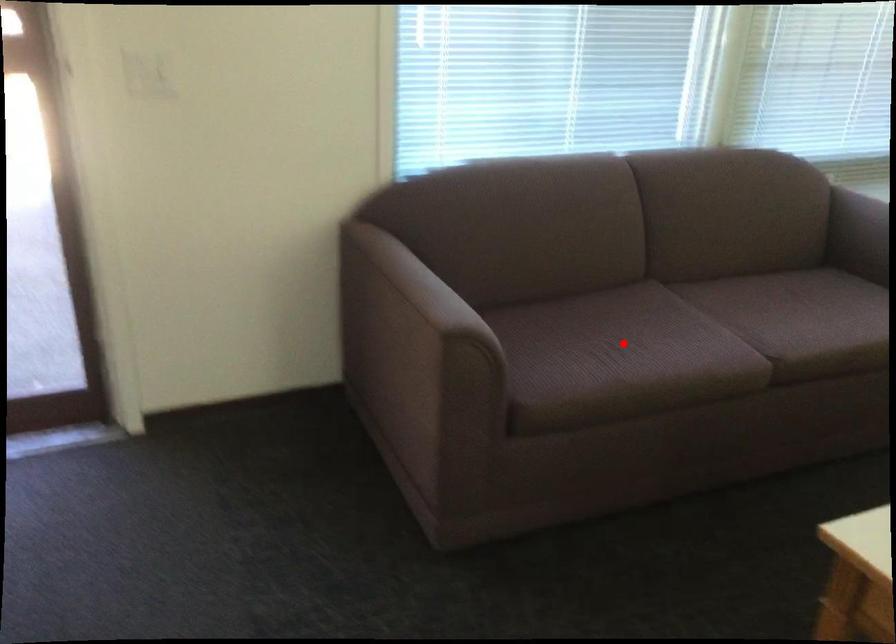
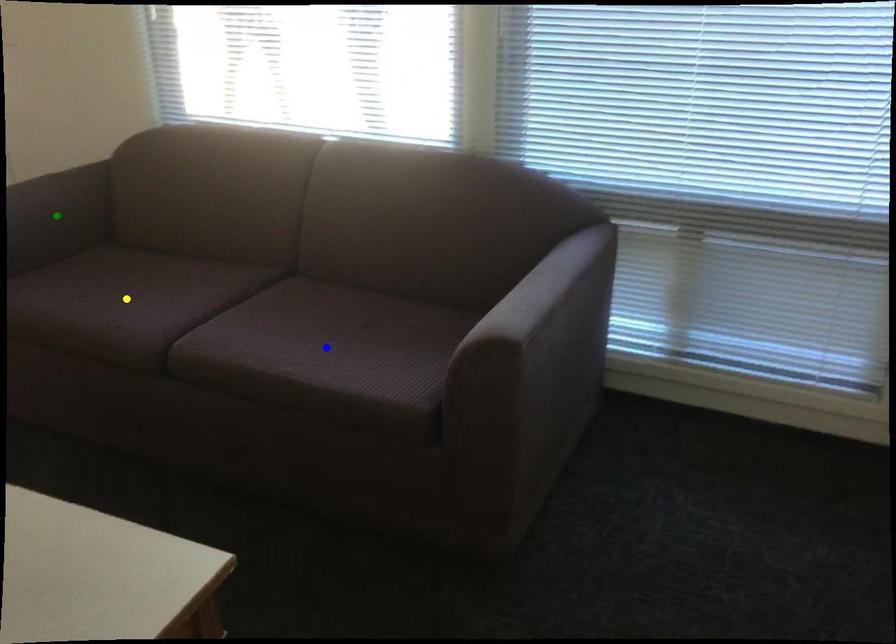
Question: I am providing you with two images of the same scene from different viewpoints. A red point is marked on the first image. You are given multiple points on the second image. Can you choose the point in image 2 that corresponds to the point in image 1?

Choices:
 (A) blue point
 (B) yellow point
 (C) green point

Answer: (B)